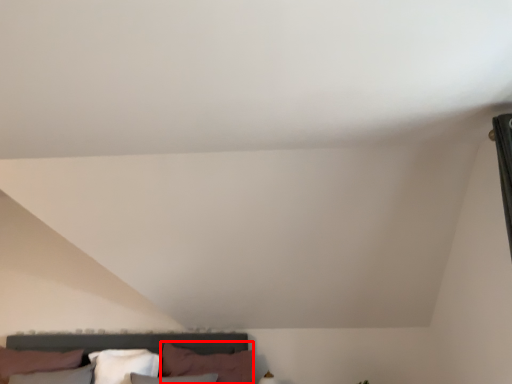
Question: In this image, where is pillow (annotated by the red box) located relative to pillow?

Choices:
 (A) left
 (B) right

Answer: (B)